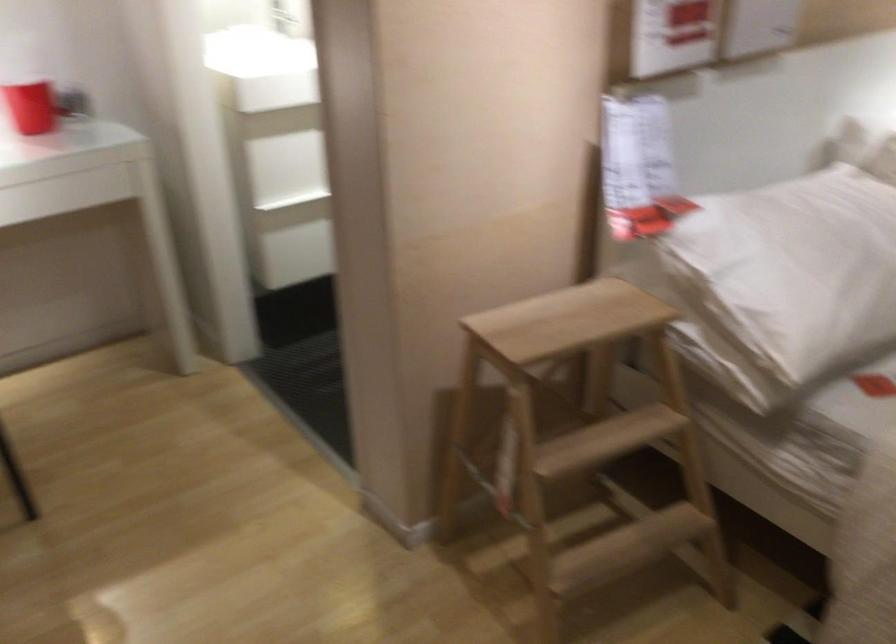
Image resolution: width=896 pixels, height=644 pixels. Identify the location of wooden step stool. (582, 436).